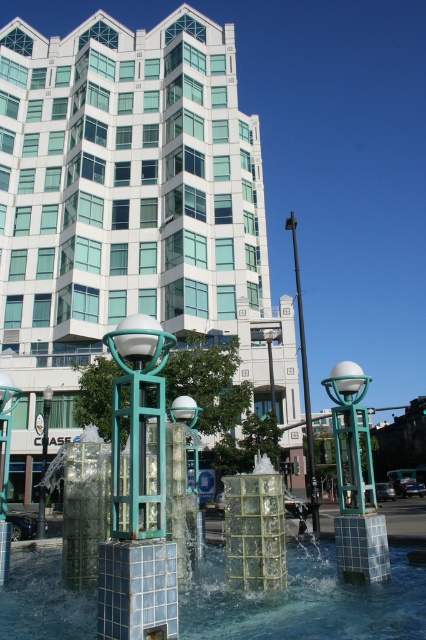
Who is more distant from viewer, (23, 492) or (218, 586)?

Positioned behind is point (23, 492).

Does white glass building at center appear under translucent glass water at center?

No.

Which is in front, point (103, 163) or point (190, 588)?

Point (190, 588) is in front.

In order to click on white glass building at center in this screenshot , I will do `click(127, 211)`.

Is translucent glass water at center to the left of metallic pole at center from the viewer's perspective?

Indeed, translucent glass water at center is positioned on the left side of metallic pole at center.

Is translucent glass water at center below metallic pole at center?

Correct, translucent glass water at center is located below metallic pole at center.

Is point (365, 614) behind point (310, 417)?

No, (365, 614) is closer to viewer.

Find the location of a particular element. The width and height of the screenshot is (426, 640). translucent glass water at center is located at coordinates (305, 602).

Between white glass building at center and metallic pole at center, which one appears on the left side from the viewer's perspective?

white glass building at center

Which is in front, point (101, 214) or point (302, 317)?

Point (101, 214)

Who is more distant from viewer, (52, 100) or (296, 289)?

Positioned behind is point (296, 289).

This screenshot has height=640, width=426. What are the coordinates of `white glass building at center` in the screenshot? It's located at (127, 211).